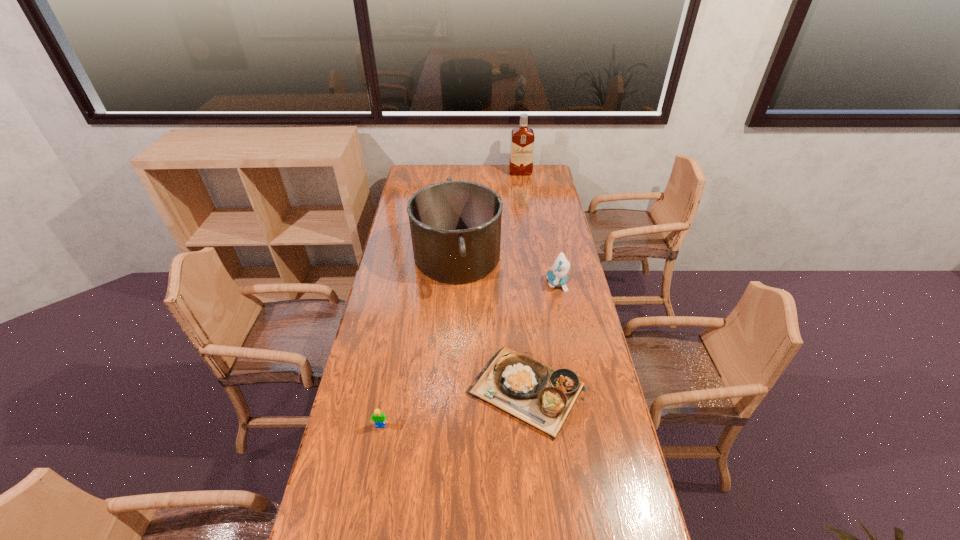
The image size is (960, 540). Find the location of `the farthest object`. the farthest object is located at coordinates (522, 138).

At what (x,y) coordinates should I click in order to perform the action: click on the tallest object. Please return your answer as a coordinate pair (x, y). The image size is (960, 540). Looking at the image, I should click on (522, 138).

At what (x,y) coordinates should I click in order to perform the action: click on pan. Please return your answer as a coordinate pair (x, y). Looking at the image, I should click on (455, 226).

Where is `the third tallest object`? The height and width of the screenshot is (540, 960). the third tallest object is located at coordinates (557, 277).

What are the coordinates of `the second shortest object` in the screenshot? It's located at (379, 418).

Locate an element on the screen. The height and width of the screenshot is (540, 960). the shortest object is located at coordinates (542, 397).

Where is `vacant space located on the front label of the tallest object`? The image size is (960, 540). vacant space located on the front label of the tallest object is located at coordinates (522, 184).

Where is `free point located on the back of the second tallest object`? The image size is (960, 540). free point located on the back of the second tallest object is located at coordinates (462, 189).

Where is `vacant region located on the face of the kitten`? This screenshot has height=540, width=960. vacant region located on the face of the kitten is located at coordinates coord(472,284).

The height and width of the screenshot is (540, 960). I want to click on vacant region located on the face of the kitten, so click(451, 284).